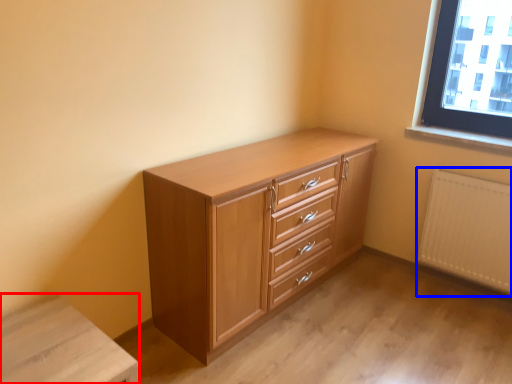
Question: Which point is closer to the camera, changing table (highlighted by a red box) or radiator (highlighted by a blue box)?

Choices:
 (A) changing table
 (B) radiator

Answer: (A)